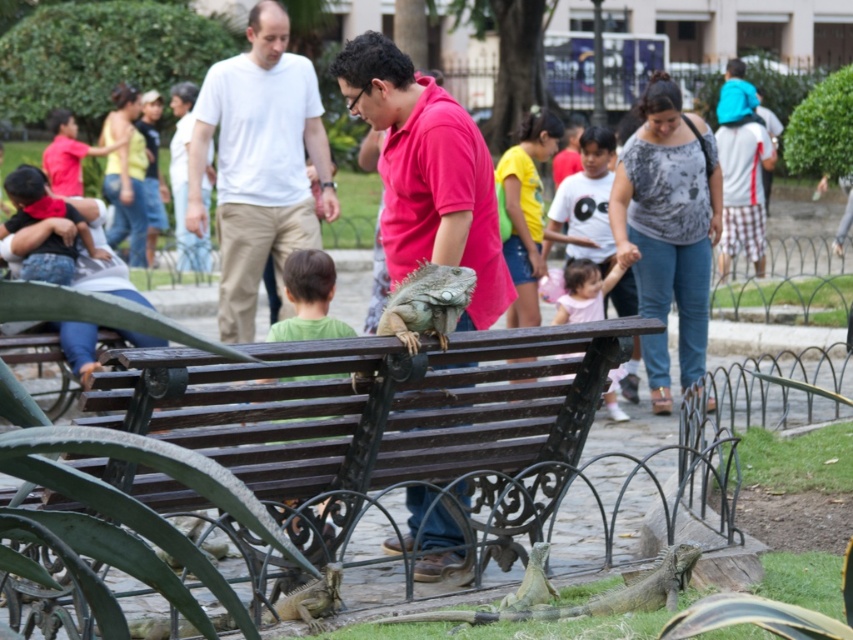
Question: Can you confirm if white cotton shirt at center is bigger than green scaly lizard at center?

Choices:
 (A) no
 (B) yes

Answer: (B)

Question: Estimate the real-world distances between objects in this image. Which object is farther from the matte red shirt at center?

Choices:
 (A) brown wooden bench at center
 (B) green scaly lizard at center
 (C) white cotton shirt at center

Answer: (C)

Question: Among these objects, which one is farthest from the camera?

Choices:
 (A) brown wooden bench at center
 (B) matte red shirt at center
 (C) white cotton shirt at center

Answer: (C)

Question: Which point appears farthest from the camera in this image?

Choices:
 (A) (339, 372)
 (B) (195, 218)
 (C) (392, 307)
 (D) (398, 177)

Answer: (B)

Question: Is matte red shirt at center further to camera compared to green scaly lizard at center?

Choices:
 (A) yes
 (B) no

Answer: (A)

Question: Does matte red shirt at center appear on the right side of green matte shirt at center?

Choices:
 (A) yes
 (B) no

Answer: (A)